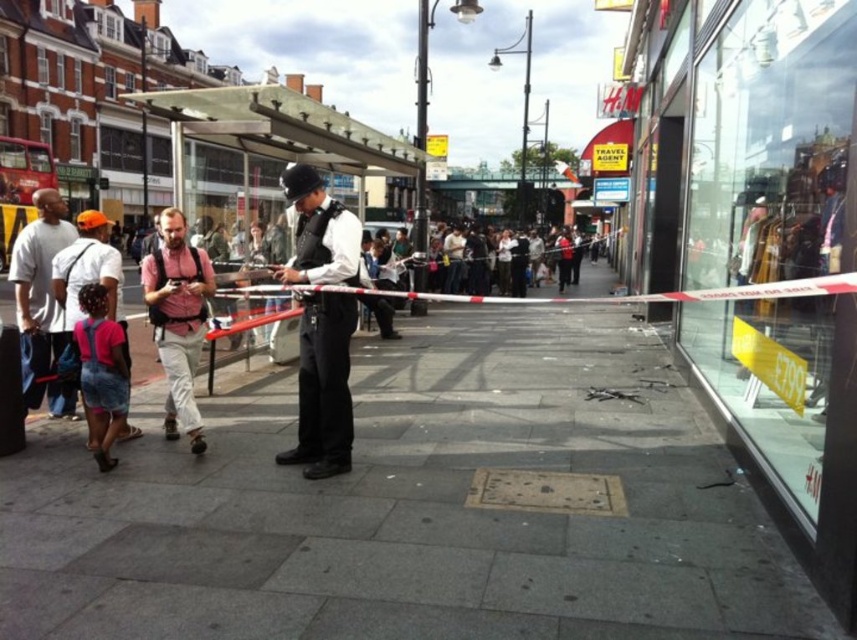
Question: Is the position of smooth concrete pavement at center more distant than that of shiny black helmet at center?

Choices:
 (A) yes
 (B) no

Answer: (B)

Question: Which point is closer to the camera?

Choices:
 (A) (109, 369)
 (B) (181, 340)

Answer: (A)

Question: In this image, where is shiny black helmet at center located relative to matte gray shirt at left?

Choices:
 (A) right
 (B) left

Answer: (A)

Question: Which is nearer to the smooth concrete pavement at center?

Choices:
 (A) pink fabric shirt at center
 (B) transparent plastic bus stop at center
 (C) matte gray shirt at left

Answer: (A)

Question: Considering the real-world distances, which object is farthest from the matte gray shirt at left?

Choices:
 (A) denim overalls at lower left
 (B) smooth concrete pavement at center

Answer: (B)

Question: Considering the relative positions of transparent plastic bus stop at center and pink fabric shirt at center in the image provided, where is transparent plastic bus stop at center located with respect to pink fabric shirt at center?

Choices:
 (A) below
 (B) above

Answer: (B)